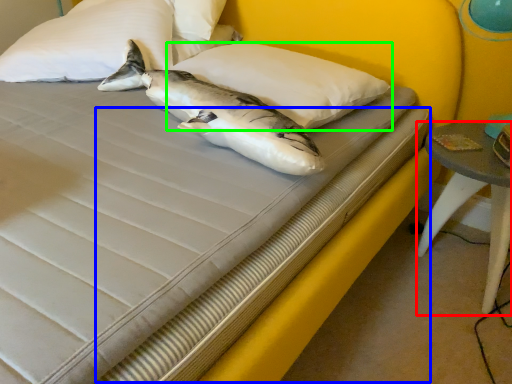
Question: Which object is positioned farthest from table (highlighted by a red box)? Select from bed frame (highlighted by a blue box) and pillow (highlighted by a green box).

Choices:
 (A) bed frame
 (B) pillow

Answer: (B)